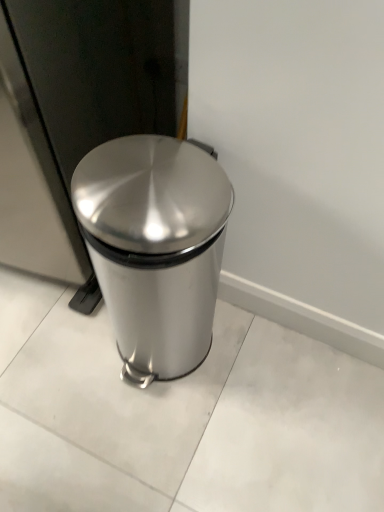
Describe the element at coordinates (155, 246) in the screenshot. This screenshot has height=512, width=384. I see `satin silver trash can at center` at that location.

Identify the location of satin silver trash can at center. The image size is (384, 512). (155, 246).

In order to face satin silver trash can at center, should I rotate leftwards or rightwards?

Turn left approximately 4.384 degrees to face it.

I want to click on satin silver trash can at center, so click(155, 246).